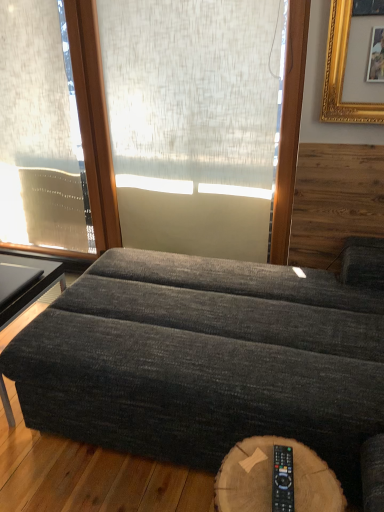
The image size is (384, 512). Describe the element at coordinates (209, 358) in the screenshot. I see `dark gray fabric ottoman at center` at that location.

This screenshot has width=384, height=512. I want to click on dark gray fabric ottoman at lower left, so click(31, 284).

The height and width of the screenshot is (512, 384). I want to click on translucent beige curtain at left, so click(x=40, y=132).

Is black plastic remote at lower right inside translucent beige curtain at left?

No, black plastic remote at lower right is not inside translucent beige curtain at left.

Which is further, (28, 76) or (273, 475)?

The point (28, 76) is farther from the camera.

From a real-world perspective, which object stands above the other?

translucent beige curtain at left is physically above.

Relative to black plastic remote at lower right, is translucent beige curtain at left in front or behind?

In the image, translucent beige curtain at left appears behind black plastic remote at lower right.

Looking at this image, could you tell me if dark gray fabric ottoman at lower left is turned towards translucent beige curtain at left?

No, dark gray fabric ottoman at lower left is not turned towards translucent beige curtain at left.

Relative to translucent beige curtain at left, is dark gray fabric ottoman at lower left in front or behind?

dark gray fabric ottoman at lower left is positioned closer to the viewer than translucent beige curtain at left.

Considering the positions of objects dark gray fabric ottoman at lower left and translucent beige curtain at left in the image provided, who is more to the left, dark gray fabric ottoman at lower left or translucent beige curtain at left?

translucent beige curtain at left.

Which is closer to the camera, [325,489] or [199,165]?

The point [325,489] is in front.

You are a GUI agent. You are given a task and a screenshot of the screen. Output one action in this format:
    pyautogui.click(x=<x>, y=<y>)
    Task: Click on the round table that appears in front of the white textured screen at center
    
    Given the screenshot: What is the action you would take?
    pyautogui.click(x=271, y=479)

Which of these two, wooden log table at lower center or white textured screen at center, is wider?

wooden log table at lower center.

Based on the photo, between wooden log table at lower center and dark gray fabric ottoman at lower left, which one has less height?

With less height is wooden log table at lower center.

Based on the photo, how much distance is there between wooden log table at lower center and dark gray fabric ottoman at lower left?

wooden log table at lower center is 1.14 meters from dark gray fabric ottoman at lower left.

Between point (217, 499) and point (7, 312), which one is positioned in front?

The point (217, 499) is closer.

Can you confirm if wooden log table at lower center is smaller than dark gray fabric ottoman at lower left?

Correct, wooden log table at lower center occupies less space than dark gray fabric ottoman at lower left.

Is dark gray fabric ottoman at lower left completely or partially inside translucent beige curtain at left?

No.

The image size is (384, 512). Identify the location of table below the translucent beige curtain at left (from a real-world perspective). [31, 284].

Which object is further away from the camera taking this photo, translucent beige curtain at left or dark gray fabric ottoman at lower left?

translucent beige curtain at left is more distant.

How many degrees apart are the facing directions of translucent beige curtain at left and dark gray fabric ottoman at lower left?

They differ by 0.0543 degrees in their facing directions.

Between white textured screen at center and translucent beige curtain at left, which one has more height?

translucent beige curtain at left.

Is white textured screen at center looking in the opposite direction of translucent beige curtain at left?

No, white textured screen at center's orientation is not away from translucent beige curtain at left.

Based on the photo, from a real-world perspective, who is located lower, white textured screen at center or translucent beige curtain at left?

translucent beige curtain at left is physically lower.

Identify the location of table on the left of wooden log table at lower center. (31, 284).

Is wooden log table at lower center at the back of dark gray fabric ottoman at lower left?

No, dark gray fabric ottoman at lower left's orientation is not away from wooden log table at lower center.

Is dark gray fabric ottoman at lower left wider or thinner than wooden log table at lower center?

In the image, dark gray fabric ottoman at lower left appears to be wider than wooden log table at lower center.

From a real-world perspective, is dark gray fabric ottoman at lower left on wooden log table at lower center?

No, from a real-world perspective, dark gray fabric ottoman at lower left is not on top of wooden log table at lower center.

Identify the location of window above the black plastic remote at lower right (from a real-world perspective). [40, 132].

You are a GUI agent. You are given a task and a screenshot of the screen. Output one action in this format:
    pyautogui.click(x=<x>, y=<y>)
    Task: Click on the table that appears below the translucent beige curtain at left (from the image's perspective)
    
    Given the screenshot: What is the action you would take?
    pyautogui.click(x=31, y=284)

Considering their positions, is dark gray fabric ottoman at center positioned further to translucent beige curtain at left than white textured screen at center?

dark gray fabric ottoman at center is positioned further to the anchor translucent beige curtain at left.

Looking at the image, which one is located further to translucent beige curtain at left, dark gray fabric ottoman at center or dark gray fabric ottoman at lower left?

Based on the image, dark gray fabric ottoman at center appears to be further to translucent beige curtain at left.

Considering their positions, is white textured screen at center positioned further to dark gray fabric ottoman at lower left than dark gray fabric ottoman at center?

Among the two, white textured screen at center is located further to dark gray fabric ottoman at lower left.

Considering their positions, is dark gray fabric ottoman at center positioned further to wooden log table at lower center than white textured screen at center?

white textured screen at center is positioned further to the anchor wooden log table at lower center.

Estimate the real-world distances between objects in this image. Which object is further from black plastic remote at lower right, translucent beige curtain at left or dark gray fabric ottoman at lower left?

translucent beige curtain at left is further to black plastic remote at lower right.

Based on the photo, considering their positions, is dark gray fabric ottoman at lower left positioned closer to black plastic remote at lower right than dark gray fabric ottoman at center?

dark gray fabric ottoman at center is positioned closer to the anchor black plastic remote at lower right.

From the image, which object appears to be nearer to translucent beige curtain at left, white textured screen at center or wooden log table at lower center?

white textured screen at center is positioned closer to the anchor translucent beige curtain at left.

Looking at the image, which one is located further to black plastic remote at lower right, dark gray fabric ottoman at center or wooden log table at lower center?

Among the two, dark gray fabric ottoman at center is located further to black plastic remote at lower right.

Find the location of a particular element. window screen between translucent beige curtain at left and black plastic remote at lower right in the up-down direction is located at coordinates (194, 93).

Locate an element on the screen. The height and width of the screenshot is (512, 384). remote between white textured screen at center and wooden log table at lower center from top to bottom is located at coordinates (282, 479).

Identify the location of window screen situated between dark gray fabric ottoman at lower left and dark gray fabric ottoman at center from left to right. (194, 93).

Find the location of `window screen positioned between dark gray fabric ottoman at center and translucent beige curtain at left from near to far`. window screen positioned between dark gray fabric ottoman at center and translucent beige curtain at left from near to far is located at coordinates (194, 93).